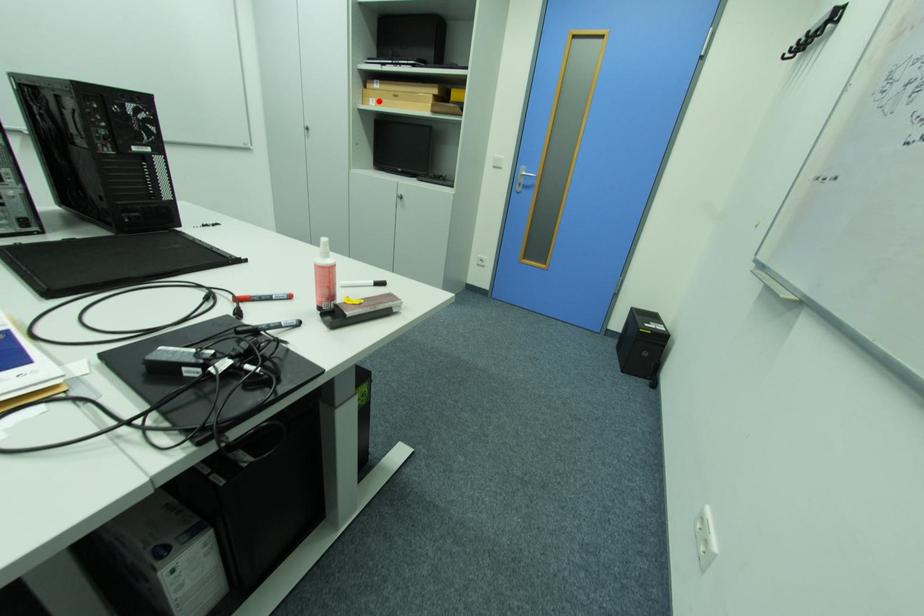
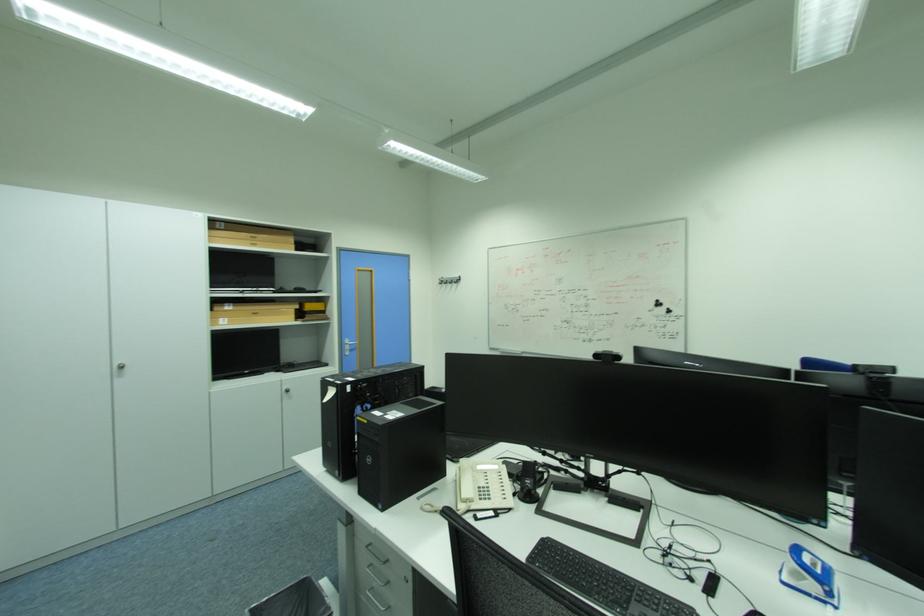
Question: I am providing you with two images of the same scene from different viewpoints. Image1 has a red point marked. In image2, the corresponding 3D location appears at what relative position? Reply with the corresponding letter.

Choices:
 (A) Closer
 (B) Farther

Answer: (B)